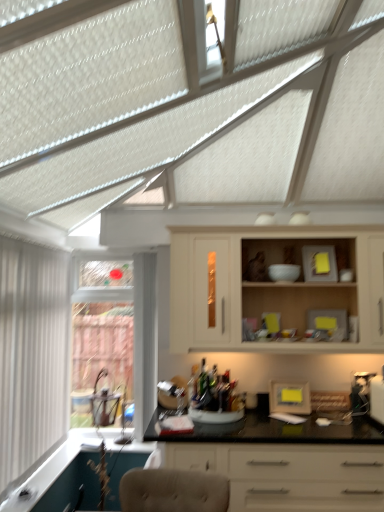
Question: In the image, is matte cream cabinet at center positioned in front of or behind white vertical blinds at left, which ranks as the 1th window in front-to-back order?

Choices:
 (A) behind
 (B) front

Answer: (A)

Question: Considering the positions of matte cream cabinet at center and white vertical blinds at left, which ranks as the 1th window in front-to-back order, in the image, is matte cream cabinet at center bigger or smaller than white vertical blinds at left, which ranks as the 1th window in front-to-back order,?

Choices:
 (A) big
 (B) small

Answer: (A)

Question: Estimate the real-world distances between objects in this image. Which object is closer to the white vertical blinds at left, which ranks as the 1th window in front-to-back order?

Choices:
 (A) matte cream cabinet at center
 (B) clear glass window at left, positioned as the first window in back-to-front order
 (C) yellow matte frame at center
 (D) black glossy countertop at center

Answer: (B)

Question: Which object is positioned closest to the black glossy countertop at center?

Choices:
 (A) matte cream cabinet at center
 (B) white vertical blinds at left, the 2th window from the back
 (C) clear glass window at left, positioned as the first window in back-to-front order
 (D) yellow matte frame at center

Answer: (D)